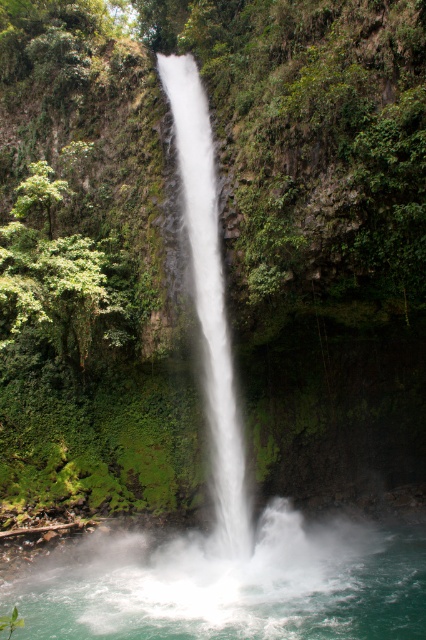
Measure the distance between clear water at center and white frothy water at center.

clear water at center and white frothy water at center are 4.13 meters apart.

Can you confirm if clear water at center is thinner than white frothy water at center?

In fact, clear water at center might be wider than white frothy water at center.

Where is `clear water at center`? clear water at center is located at coordinates (235, 588).